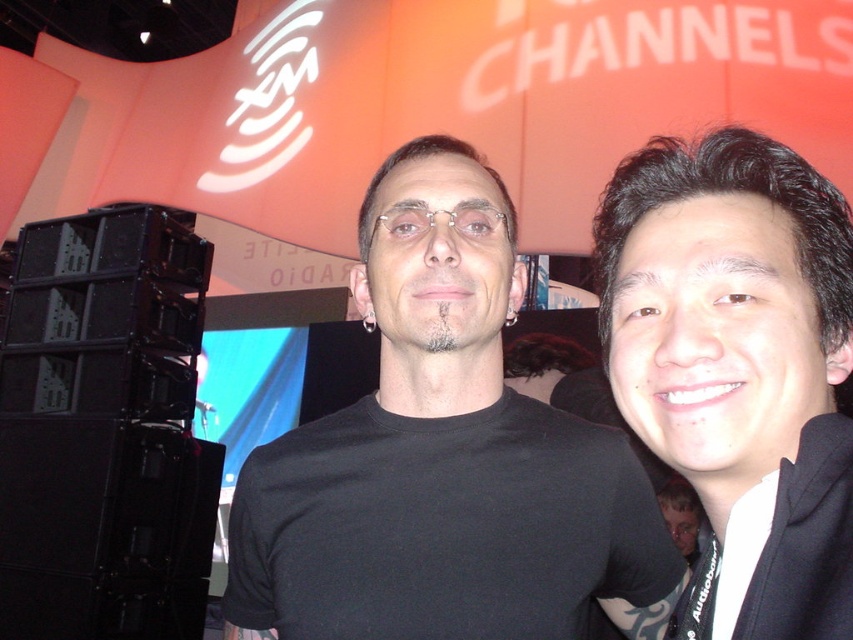
What is located at the coordinates point (440, 452) in the image?

The black matte t shirt at center is located at point (440, 452).

You are a photographer at the event and want to ensure both the white matte hoodie at right and the smooth skin face at center are clearly visible in the photo. Given their sizes, which object might require you to adjust your camera focus more carefully to avoid blurriness?

The white matte hoodie at right has a smaller size compared to the smooth skin face at center, so it might require more careful focus adjustment to ensure clarity due to its smaller size.